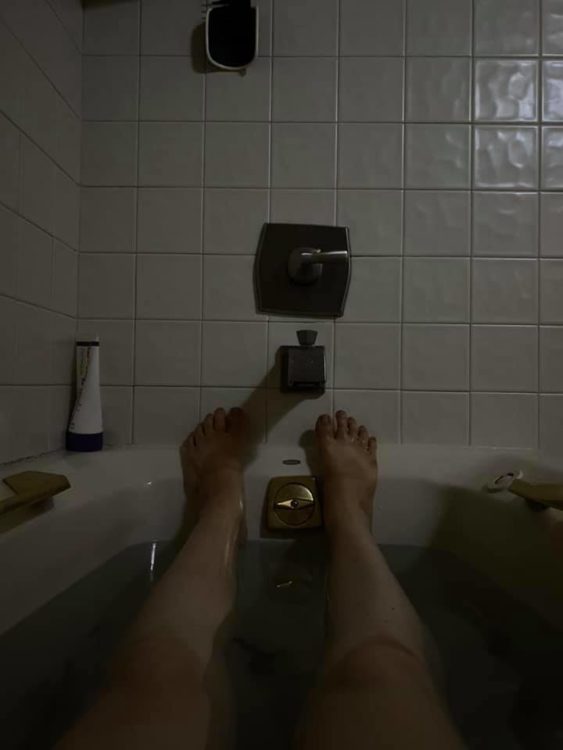
You are a GUI agent. You are given a task and a screenshot of the screen. Output one action in this format:
    pyautogui.click(x=<x>, y=<y>)
    Task: Click on the shower water control handle
    
    Given the screenshot: What is the action you would take?
    pyautogui.click(x=335, y=255)